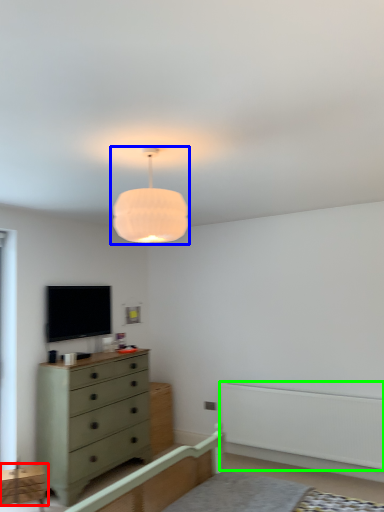
Question: Estimate the real-world distances between objects in this image. Which object is closer to cabinetry (highlighted by a red box), lamp (highlighted by a blue box) or balustrade (highlighted by a green box)?

Choices:
 (A) lamp
 (B) balustrade

Answer: (B)